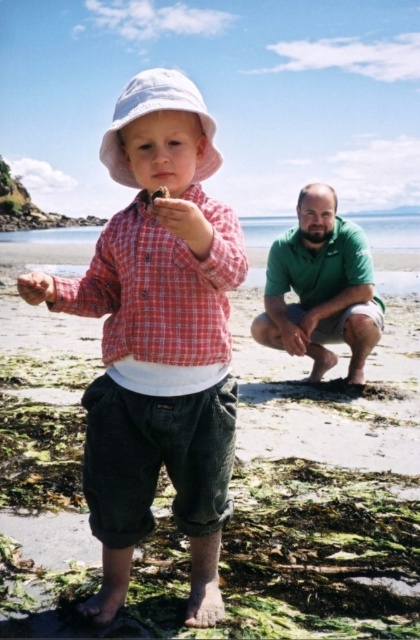
You are a fashion designer observing the beach scene. You need to create a new outfit that includes both the matte red plaid shirt at center and the white fabric hat at center. Based on their sizes, which item should be placed first in the outfit design to ensure proper proportion?

The matte red plaid shirt at center has a smaller width than the white fabric hat at center, so the matte red plaid shirt at center should be placed first in the outfit design to maintain proper proportions.

You are a photographer trying to capture a photo of the green cotton shirt at lower right and the white fabric hat at center. Which object should you focus on first if you want to ensure both are in focus?

The green cotton shirt at lower right is below the white fabric hat at center, so focusing on the white fabric hat at center first would ensure both are in focus since it is closer to the camera.

You are a photographer trying to capture a group photo of the matte red plaid shirt at center and the red checkered shirt at center. The camera you are using has a minimum focus distance of 14 centimeters. Can you take a clear photo of both shirts at the same time?

The distance between the matte red plaid shirt at center and red checkered shirt at center is 13.84 centimeters, which is less than the camera minimum focus distance of 14 centimeters. Therefore, the camera cannot focus on both shirts simultaneously, so you cannot take a clear photo of both shirts at the same time.